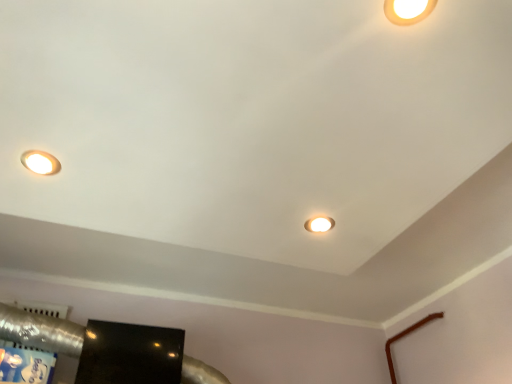
Question: Considering the relative sizes of matte white lamp at upper left, placed as the second lamp when sorted from front to back, and glossy black tv at lower left in the image provided, is matte white lamp at upper left, placed as the second lamp when sorted from front to back, bigger than glossy black tv at lower left?

Choices:
 (A) yes
 (B) no

Answer: (B)

Question: From the image's perspective, is matte white lamp at upper left, the first lamp from the left, over glossy black tv at lower left?

Choices:
 (A) no
 (B) yes

Answer: (B)

Question: From the image's perspective, is matte white lamp at upper left, which is counted as the 2th lamp, starting from the top, below glossy black tv at lower left?

Choices:
 (A) yes
 (B) no

Answer: (B)

Question: Is matte white lamp at upper left, which appears as the third lamp when viewed from the right, not near glossy black tv at lower left?

Choices:
 (A) yes
 (B) no

Answer: (B)

Question: Could you tell me if matte white lamp at upper left, which appears as the 2th lamp when ordered from the bottom, is facing glossy black tv at lower left?

Choices:
 (A) yes
 (B) no

Answer: (B)

Question: Is matte white lamp at center, which is the third lamp in front-to-back order, taller or shorter than matte white lamp at upper right, which appears as the 1th lamp when viewed from the top?

Choices:
 (A) short
 (B) tall

Answer: (B)

Question: Choose the correct answer: Is matte white lamp at center, marked as the first lamp in a back-to-front arrangement, inside matte white lamp at upper right, which appears as the 1th lamp when viewed from the top, or outside it?

Choices:
 (A) outside
 (B) inside

Answer: (A)

Question: From the image's perspective, relative to matte white lamp at upper right, the third lamp when ordered from bottom to top, is matte white lamp at center, which is counted as the third lamp, starting from the top, above or below?

Choices:
 (A) above
 (B) below

Answer: (B)

Question: Is point (323, 230) closer or farther from the camera than point (404, 13)?

Choices:
 (A) closer
 (B) farther

Answer: (B)

Question: Based on their positions, is matte white lamp at upper right, which appears as the third lamp when viewed from the back, located to the left or right of glossy black tv at lower left?

Choices:
 (A) left
 (B) right

Answer: (B)

Question: Is matte white lamp at upper right, which is counted as the 3th lamp, starting from the left, taller or shorter than glossy black tv at lower left?

Choices:
 (A) short
 (B) tall

Answer: (A)

Question: Is matte white lamp at upper right, which appears as the third lamp when viewed from the back, in front of or behind glossy black tv at lower left in the image?

Choices:
 (A) behind
 (B) front

Answer: (B)

Question: In terms of size, does matte white lamp at upper right, which appears as the third lamp when viewed from the back, appear bigger or smaller than glossy black tv at lower left?

Choices:
 (A) big
 (B) small

Answer: (B)

Question: Is matte white lamp at upper left, which is counted as the 2th lamp, starting from the top, in front of or behind matte white lamp at center, acting as the 2th lamp starting from the left, in the image?

Choices:
 (A) behind
 (B) front

Answer: (B)

Question: Considering the positions of matte white lamp at upper left, which is counted as the 2th lamp, starting from the top, and matte white lamp at center, which is counted as the third lamp, starting from the top, in the image, is matte white lamp at upper left, which is counted as the 2th lamp, starting from the top, wider or thinner than matte white lamp at center, which is counted as the third lamp, starting from the top,?

Choices:
 (A) thin
 (B) wide

Answer: (A)